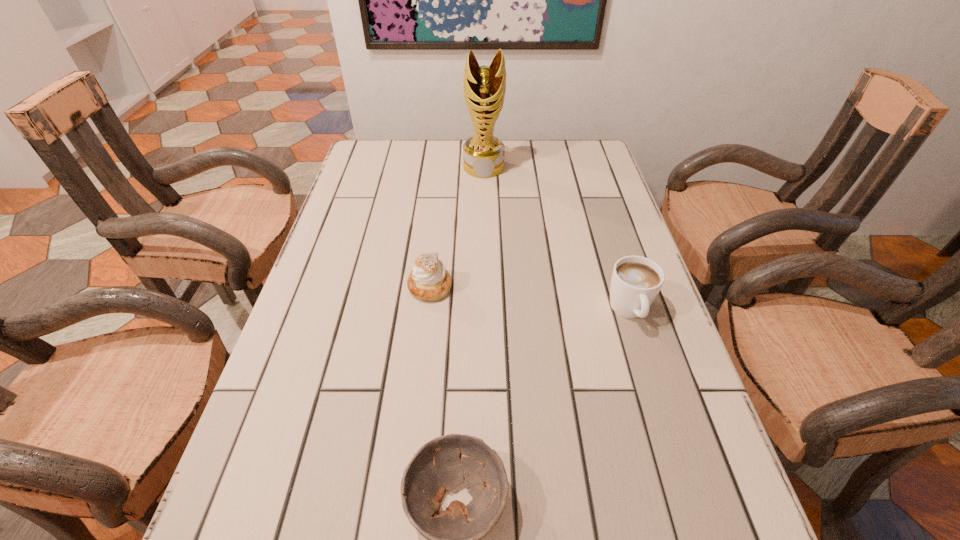
This screenshot has width=960, height=540. I want to click on object that is the third closest to the rightmost object, so click(x=484, y=87).